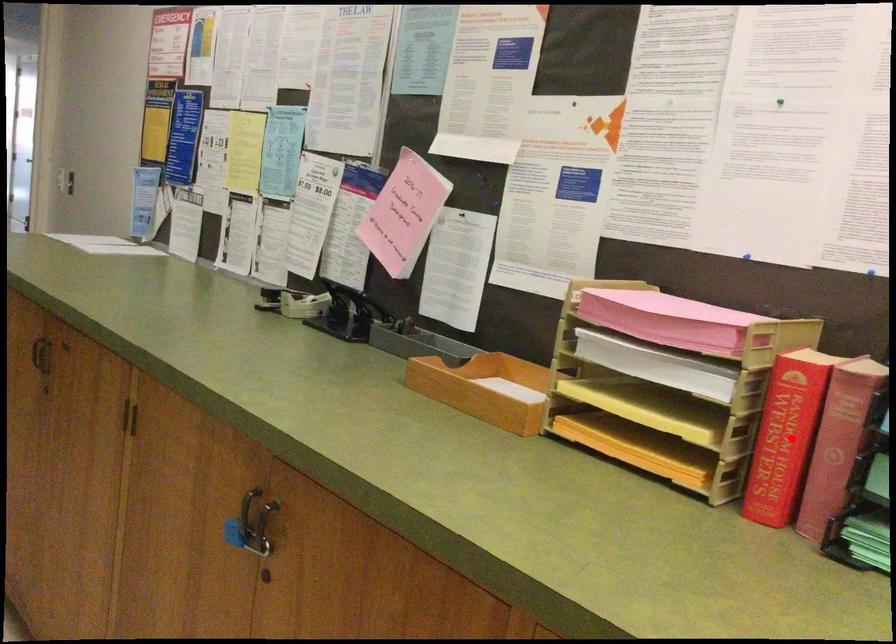
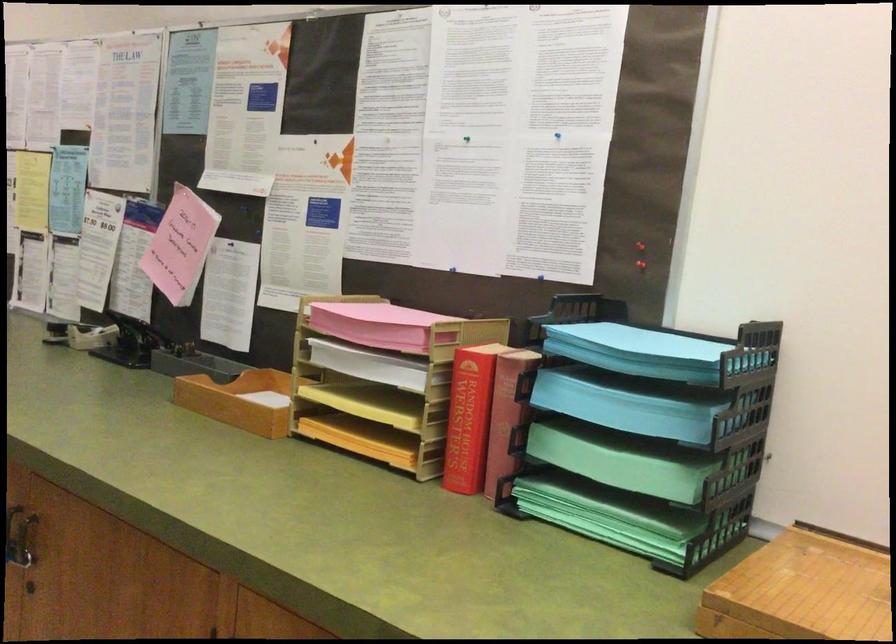
Question: A red point is marked in image1. In image2, is the corresponding 3D point closer to the camera or farther? Reply with the corresponding letter.

Choices:
 (A) The corresponding 3D point is closer.
 (B) The corresponding 3D point is farther.

Answer: (B)